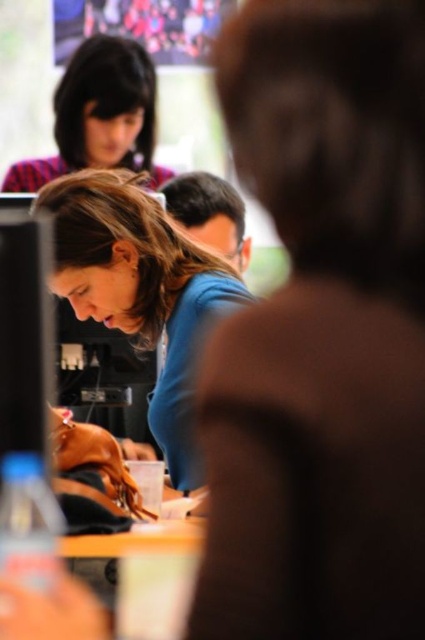
Who is lower down, blue matte shirt at center or plaid fabric headscarf at upper left?

Positioned lower is blue matte shirt at center.

Does blue matte shirt at center appear on the left side of plaid fabric headscarf at upper left?

Incorrect, blue matte shirt at center is not on the left side of plaid fabric headscarf at upper left.

Between point (99, 292) and point (113, 132), which one is positioned behind?

The point (113, 132) is behind.

The height and width of the screenshot is (640, 425). In order to click on blue matte shirt at center in this screenshot , I will do `click(141, 289)`.